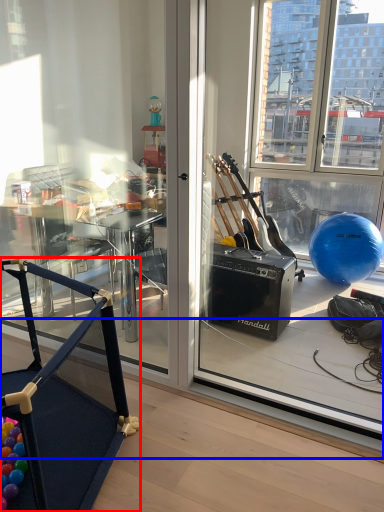
Question: Among these objects, which one is farthest to the camera, furniture (highlighted by a red box) or window sill (highlighted by a blue box)?

Choices:
 (A) furniture
 (B) window sill

Answer: (B)